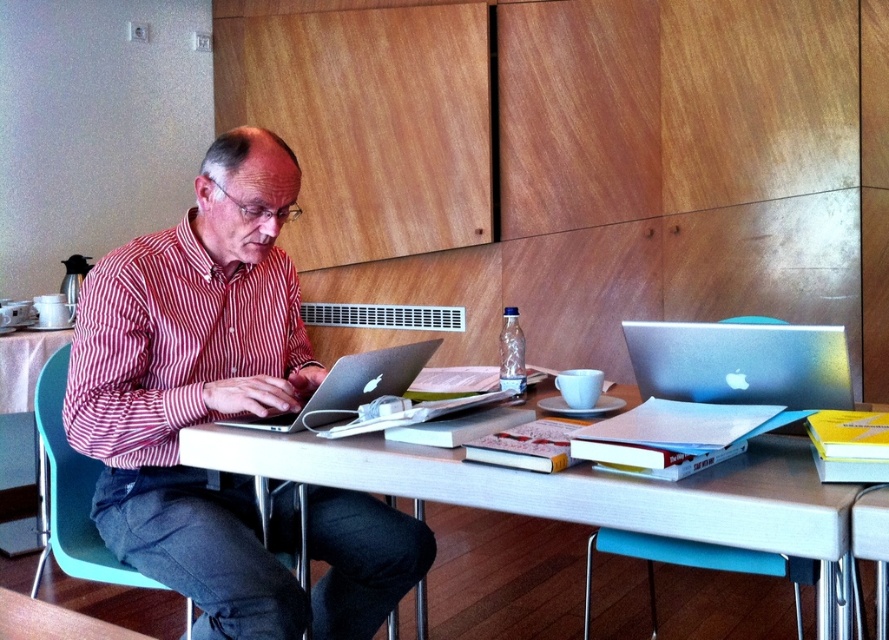
Question: Which point is farther from the camera taking this photo?

Choices:
 (A) (798, 381)
 (B) (308, 360)

Answer: (B)

Question: Can you confirm if red striped shirt at left is positioned to the left of silver metallic laptop at center?

Choices:
 (A) no
 (B) yes

Answer: (B)

Question: In this image, where is red striped shirt at center located relative to satin silver laptop at upper right?

Choices:
 (A) right
 (B) left

Answer: (B)

Question: Does red striped shirt at center have a lesser width compared to satin silver laptop at upper right?

Choices:
 (A) no
 (B) yes

Answer: (A)

Question: Which object is the closest to the red striped shirt at center?

Choices:
 (A) silver metallic laptop at center
 (B) satin silver laptop at upper right

Answer: (A)

Question: Among these points, which one is farthest from the camera?

Choices:
 (A) (787, 374)
 (B) (91, 356)

Answer: (B)